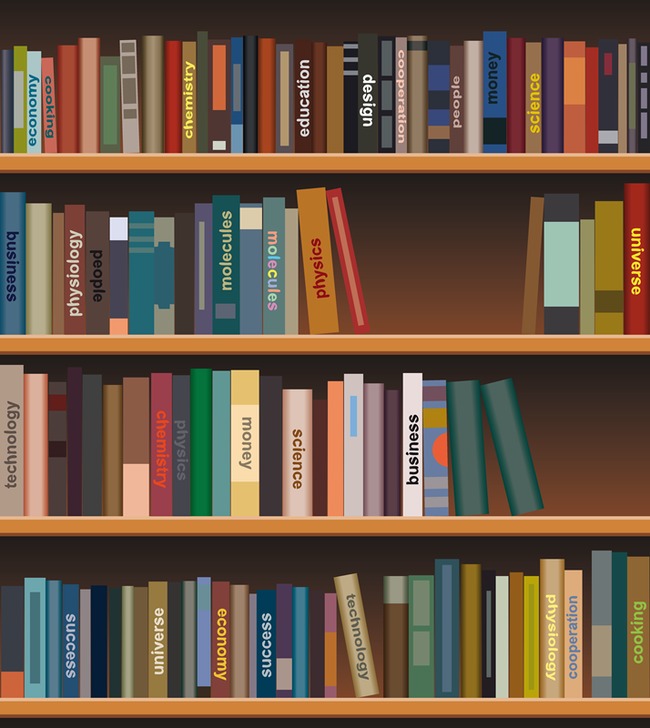
Locate an element on the screen. The height and width of the screenshot is (728, 650). shelf is located at coordinates (177, 705), (253, 522), (302, 341), (313, 158).